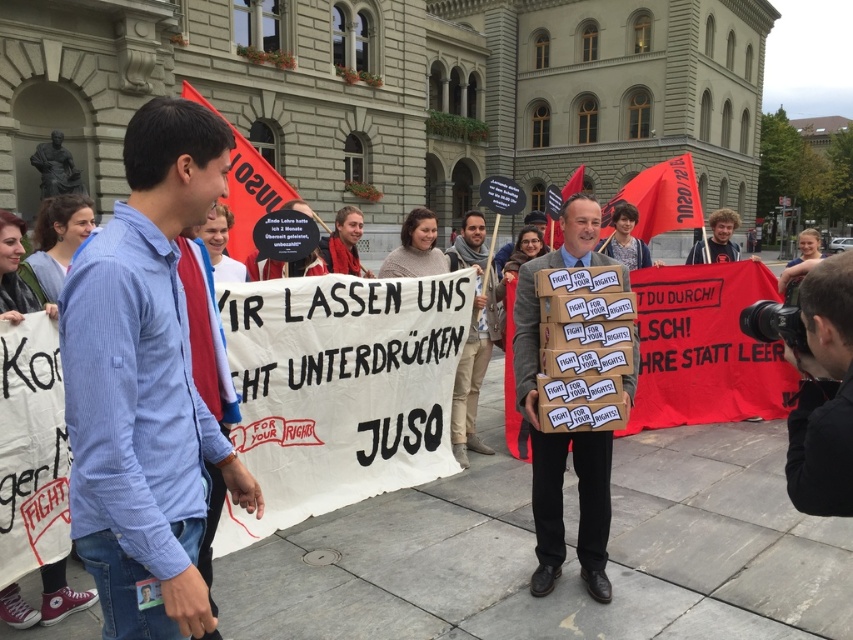
Question: Among these objects, which one is farthest from the camera?

Choices:
 (A) cardboard boxes at center
 (B) curly-haired man at center

Answer: (B)

Question: Which point appears closest to the camera in this image?

Choices:
 (A) (675, 218)
 (B) (85, 502)
 (C) (288, 186)
 (D) (572, 176)

Answer: (B)

Question: Does brown leather jacket at center have a smaller size compared to red fabric flag at upper left?

Choices:
 (A) no
 (B) yes

Answer: (B)

Question: Is matte black camera at right thinner than red fabric flag at upper right?

Choices:
 (A) no
 (B) yes

Answer: (B)

Question: Can you confirm if blue shirt at left is wider than matte black camera at right?

Choices:
 (A) yes
 (B) no

Answer: (B)

Question: Which point is farther to the camera?

Choices:
 (A) red fabric flag at upper left
 (B) red fabric flag at center
 (C) matte black camera at right
 (D) brown leather jacket at center

Answer: (B)